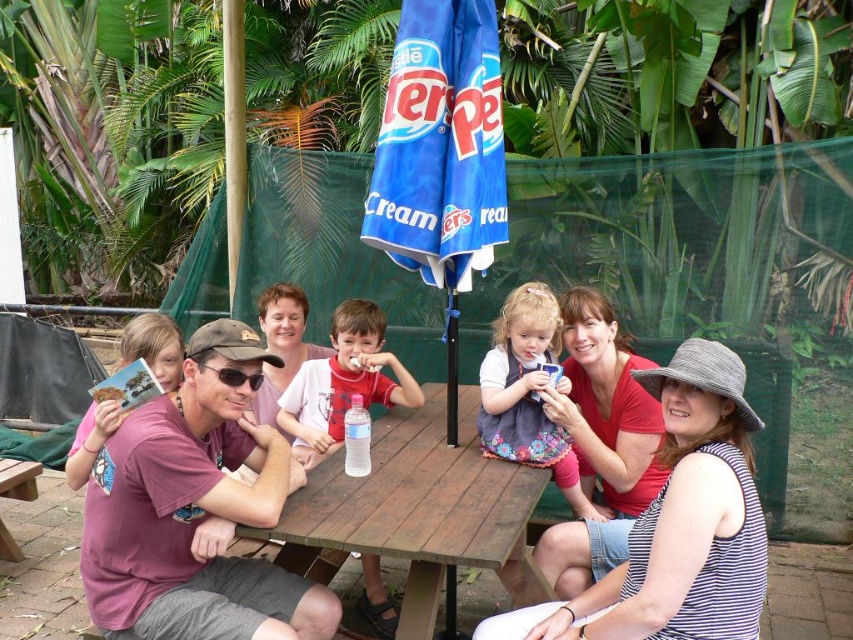
Is point (502, 570) farther from viewer compared to point (404, 381)?

No, (502, 570) is closer to viewer.

At what (x,y) coordinates should I click in order to perform the action: click on wooden table at center. Please return your answer as a coordinate pair (x, y). The image size is (853, 640). Looking at the image, I should click on (418, 513).

Is point (422, 516) positioned before point (369, 378)?

That is True.

The image size is (853, 640). I want to click on wooden table at center, so click(418, 513).

Locate an element on the screen. maroon t-shirt at center is located at coordinates (196, 509).

Does maroon t-shirt at center have a lesser width compared to red shirt boy at center?

In fact, maroon t-shirt at center might be wider than red shirt boy at center.

Between point (158, 422) and point (306, 449), which one is positioned behind?

Positioned behind is point (306, 449).

Where is `maroon t-shirt at center`? The height and width of the screenshot is (640, 853). maroon t-shirt at center is located at coordinates (196, 509).

Is point (239, 499) less distant than point (541, 412)?

Yes, point (239, 499) is closer to viewer.

Is point (91, 528) less distant than point (558, 481)?

That is True.

Where is `maroon t-shirt at center`? Image resolution: width=853 pixels, height=640 pixels. maroon t-shirt at center is located at coordinates (196, 509).